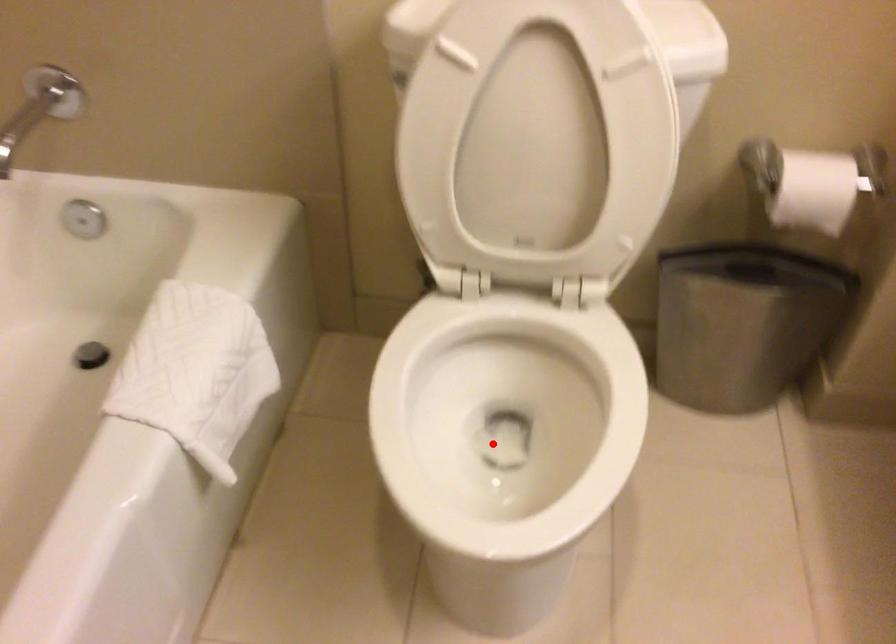
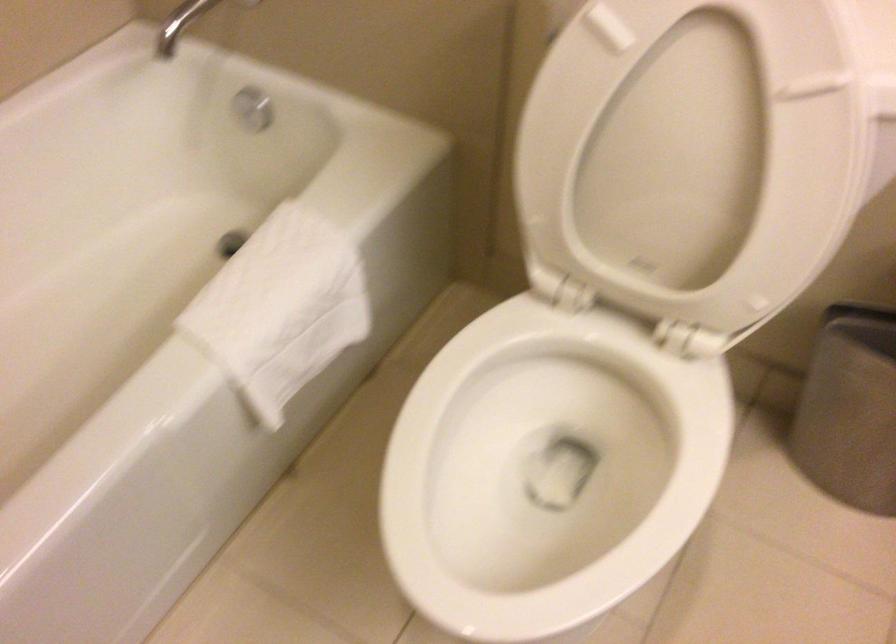
Question: I am providing you with two images of the same scene from different viewpoints. Given a red point in image1, look at the same physical point in image2. Is it:

Choices:
 (A) Closer to the viewpoint
 (B) Farther from the viewpoint

Answer: (A)